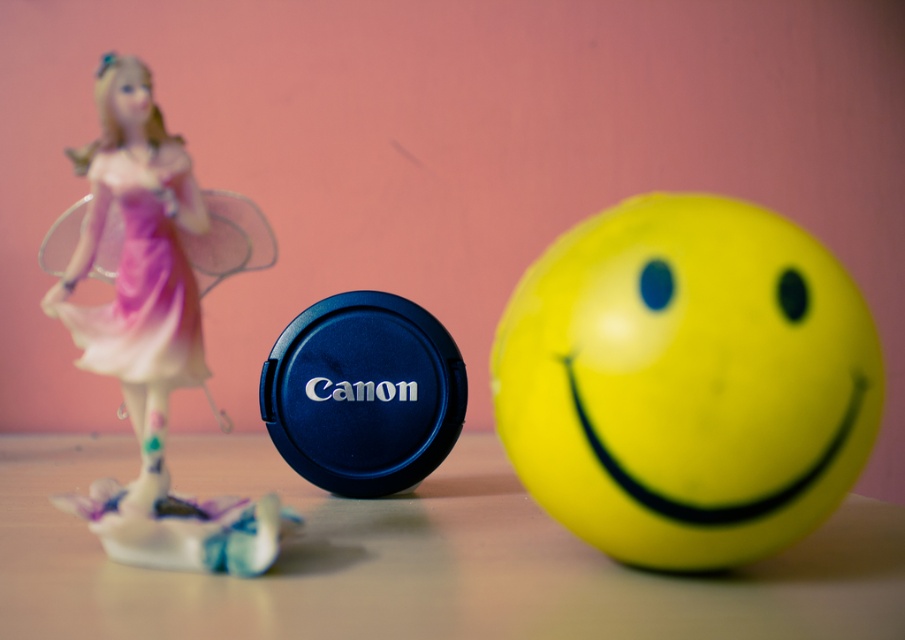
Between yellow rubber ball at center and translucent plastic face at upper left, which one appears on the left side from the viewer's perspective?

translucent plastic face at upper left

Does yellow rubber ball at center have a greater width compared to translucent plastic face at upper left?

Indeed, yellow rubber ball at center has a greater width compared to translucent plastic face at upper left.

This screenshot has height=640, width=905. Identify the location of yellow rubber ball at center. (686, 381).

Does translucent plastic fairy at left appear under pink satin dress at left?

Indeed, translucent plastic fairy at left is positioned under pink satin dress at left.

Looking at this image, which of these two, translucent plastic fairy at left or pink satin dress at left, stands shorter?

pink satin dress at left

Find the location of `translucent plastic fairy at left`. translucent plastic fairy at left is located at coordinates (151, 348).

Which of these two, yellow rubber ball at center or pink satin dress at left, stands taller?

yellow rubber ball at center

Looking at this image, does yellow rubber ball at center lie behind pink satin dress at left?

No, yellow rubber ball at center is closer to the viewer.

Does point (853, 346) lie in front of point (115, 180)?

Yes.

The width and height of the screenshot is (905, 640). In order to click on yellow rubber ball at center in this screenshot , I will do `click(686, 381)`.